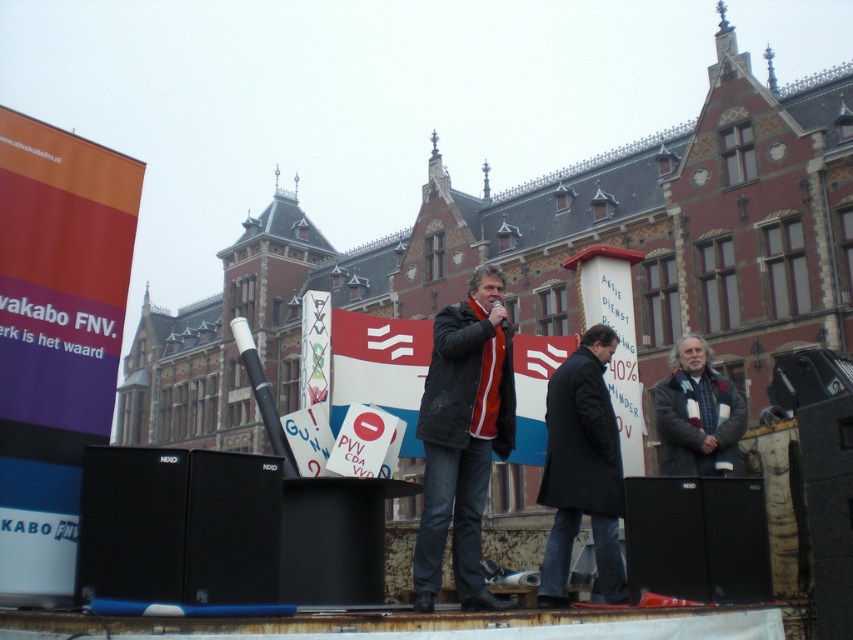
You are organizing a small event and need to place a 1.2 meter wide banner between the black matte speaker at center and the gray woolen coat at right. Based on the scene description, will the banner fit between them?

The black matte speaker at center is narrower than the gray woolen coat at right. However, without knowing the exact distance between them, we cannot determine if the 1.2 meter wide banner will fit. The description only provides information about their widths, not the space between them.

You are attending an event at the front of the building and see the dark gray jacket at center and the black matte speaker at lower right. Which object is positioned higher in the image?

The dark gray jacket at center is above the black matte speaker at lower right, so the dark gray jacket at center is positioned higher in the image.